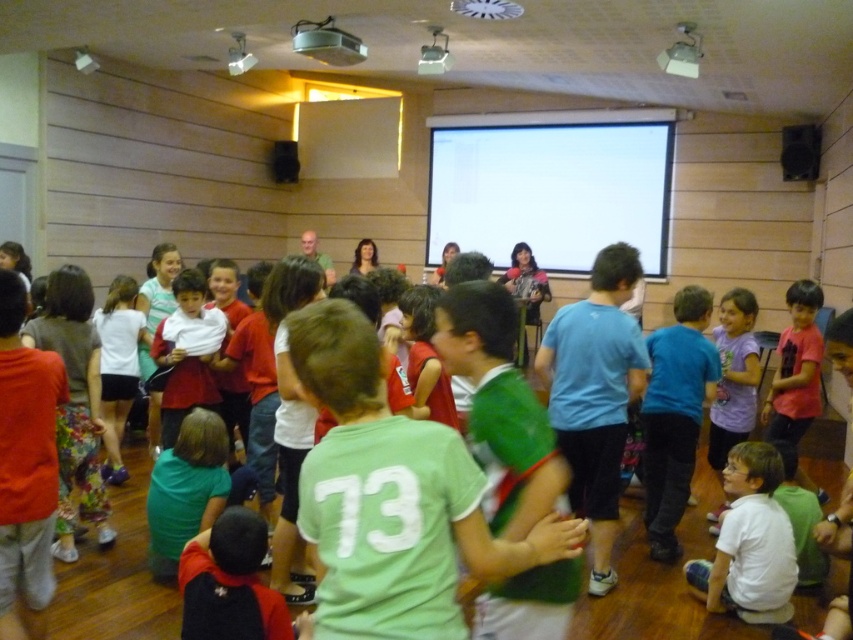
You are an event organizer trying to arrange participants for a group photo. You need to position the blue cotton shirt at center and the purple matte shirt at lower right so that they are aligned horizontally. Based on their current positions, which direction should you move one of them to achieve this alignment?

The blue cotton shirt at center is currently below the purple matte shirt at lower right. To align them horizontally, you should move the blue cotton shirt at center upward or move the purple matte shirt at lower right downward.

You are organizing a photo shoot and need to position the blue cotton shirt at center and the purple matte shirt at lower right in a way that they are both visible in the frame. Considering their heights, which shirt should be placed closer to the front to ensure both are visible?

The blue cotton shirt at center is taller than the purple matte shirt at lower right, so to ensure both are visible in the frame, the purple matte shirt at lower right should be placed closer to the front.

You are a photographer standing at the camera position. You want to capture a closeup shot of the pink matte shirt at center. Considering the distance, is it possible to do so without moving closer?

The pink matte shirt at center is 3.64 meters away from camera. A standard camera can focus on subjects at this distance, so you can capture a closeup shot without moving closer.